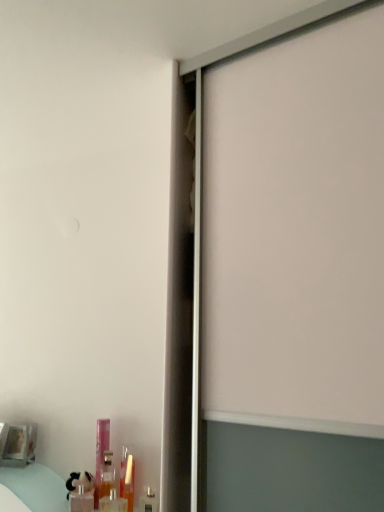
Question: Considering their positions, is metallic silver toiletry at lower left, which is counted as the fifth toiletry, starting from the left, located in front of or behind translucent plastic tube at lower left, which is the 4th toiletry in left-to-right order?

Choices:
 (A) front
 (B) behind

Answer: (A)

Question: Choose the correct answer: Is metallic silver toiletry at lower left, which is counted as the fifth toiletry, starting from the left, inside translucent plastic tube at lower left, marked as the 2th toiletry in a right-to-left arrangement, or outside it?

Choices:
 (A) inside
 (B) outside

Answer: (B)

Question: Which is farther from the translucent plastic bottle at lower left, placed as the 3th toiletry when sorted from right to left?

Choices:
 (A) translucent plastic bottle at lower left, placed as the 5th toiletry when sorted from right to left
 (B) translucent plastic tube at lower left, marked as the 2th toiletry in a right-to-left arrangement
 (C) pink plastic bottle at lower left, the second toiletry in the left-to-right sequence
 (D) metallic silver toiletry at lower left, which is counted as the fifth toiletry, starting from the left

Answer: (D)

Question: Which is farther from the translucent plastic bottle at lower left, placed as the third toiletry when sorted from left to right?

Choices:
 (A) pink plastic bottle at lower left, the 4th toiletry positioned from the right
 (B) metallic silver toiletry at lower left, which is counted as the fifth toiletry, starting from the left
 (C) translucent plastic tube at lower left, marked as the 2th toiletry in a right-to-left arrangement
 (D) translucent plastic bottle at lower left, arranged as the first toiletry when viewed from the left

Answer: (B)